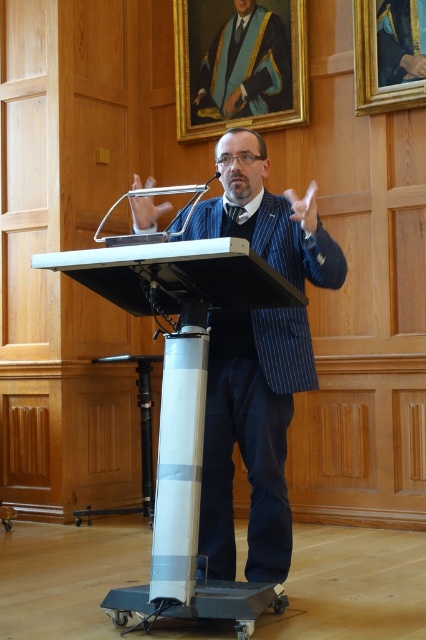
Can you confirm if white plastic podium at center is wider than matte gold and blue academic gown at upper center?

Yes, white plastic podium at center is wider than matte gold and blue academic gown at upper center.

Can you confirm if white plastic podium at center is thinner than matte gold and blue academic gown at upper center?

In fact, white plastic podium at center might be wider than matte gold and blue academic gown at upper center.

Locate an element on the screen. This screenshot has height=640, width=426. white plastic podium at center is located at coordinates (181, 404).

Which is in front, point (304, 266) or point (204, 593)?

Point (204, 593)

Is blue pinstripe suit at center thinner than white plastic podium at center?

Correct, blue pinstripe suit at center's width is less than white plastic podium at center's.

Where is `blue pinstripe suit at center`? This screenshot has width=426, height=640. blue pinstripe suit at center is located at coordinates point(252,435).

Who is shorter, blue pinstripe suit at center or matte gold and blue academic gown at upper center?

Standing shorter between the two is matte gold and blue academic gown at upper center.

Which is behind, point (206, 227) or point (264, 102)?

Point (264, 102)

What are the coordinates of `blue pinstripe suit at center` in the screenshot? It's located at (252, 435).

Find the location of a particular element. blue pinstripe suit at center is located at coordinates (252, 435).